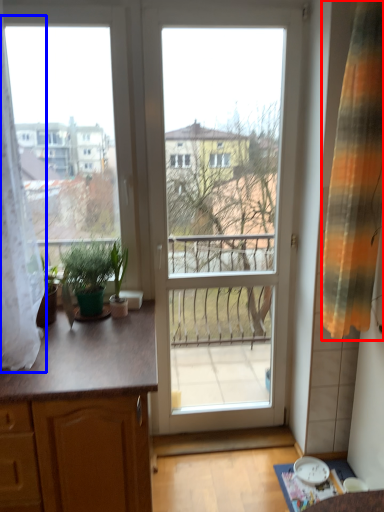
Question: Among these objects, which one is nearest to the camera, curtain (highlighted by a red box) or curtain (highlighted by a blue box)?

Choices:
 (A) curtain
 (B) curtain

Answer: (B)